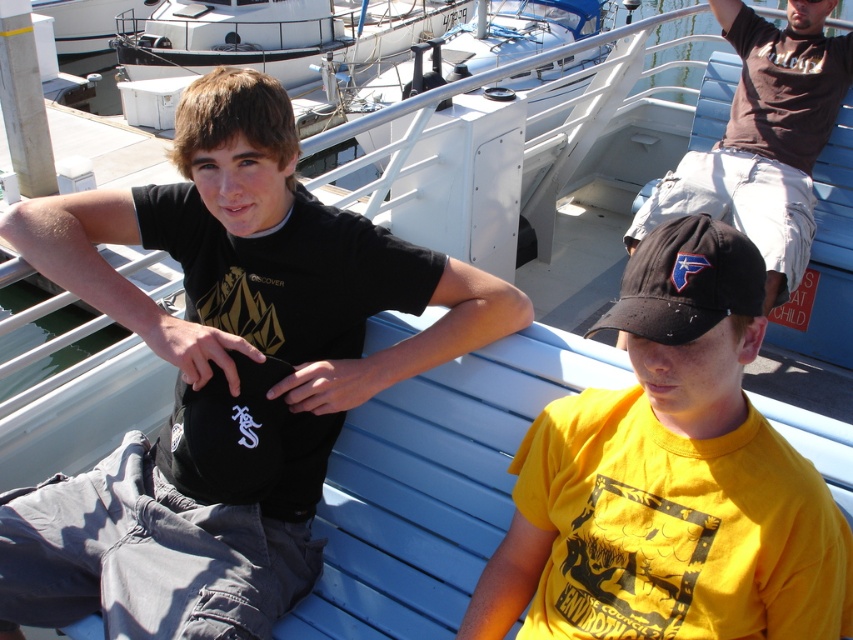
You are standing at point A which is at point (554,444) and you want to walk to point B which is at point (85,477). Which direction should you move to reach point B from point A?

To move from point A at (554,444) to point B at (85,477), you should move downward because point B is behind point A.

You are standing in the marina and looking at two points marked on the image. Which point, point (396, 253) or point (730, 310), is closer to you?

Point (396, 253) is closer to you because it is further to the viewer than point (730, 310).